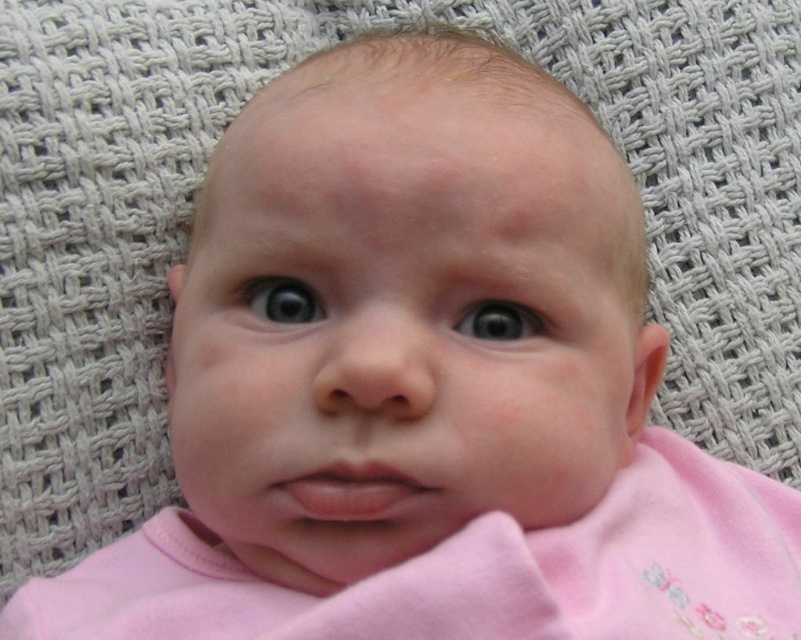
Between blue glossy eye at center and gray matte eye at center, which one appears on the right side from the viewer's perspective?

gray matte eye at center

Is blue glossy eye at center thinner than gray matte eye at center?

No.

Is point (320, 307) positioned after point (482, 305)?

Yes, point (320, 307) is behind point (482, 305).

Where is `blue glossy eye at center`? The height and width of the screenshot is (640, 801). blue glossy eye at center is located at coordinates (282, 300).